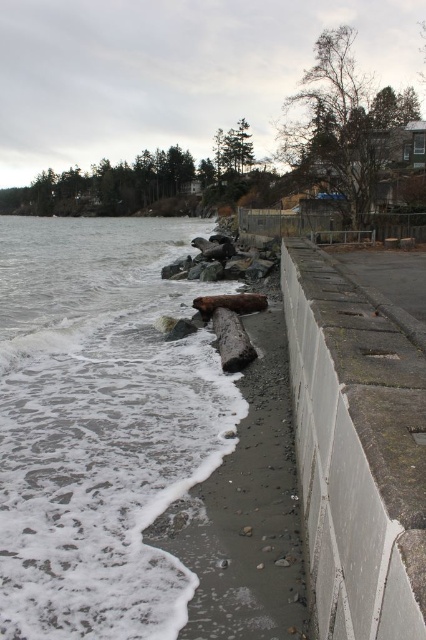
Question: Where is gray/foamy water at lower left located in relation to concrete wall at right in the image?

Choices:
 (A) right
 (B) left

Answer: (B)

Question: Can you confirm if gray/foamy water at lower left is positioned to the right of concrete wall at right?

Choices:
 (A) no
 (B) yes

Answer: (A)

Question: Which point appears closest to the camera in this image?

Choices:
 (A) (106, 458)
 (B) (336, 332)

Answer: (B)

Question: Can you confirm if gray/foamy water at lower left is positioned above concrete wall at right?

Choices:
 (A) yes
 (B) no

Answer: (A)

Question: Which object is farther from the camera taking this photo?

Choices:
 (A) gray/foamy water at lower left
 (B) concrete wall at right

Answer: (A)

Question: Which point is farther to the camera?

Choices:
 (A) [55, 609]
 (B) [307, 317]

Answer: (B)